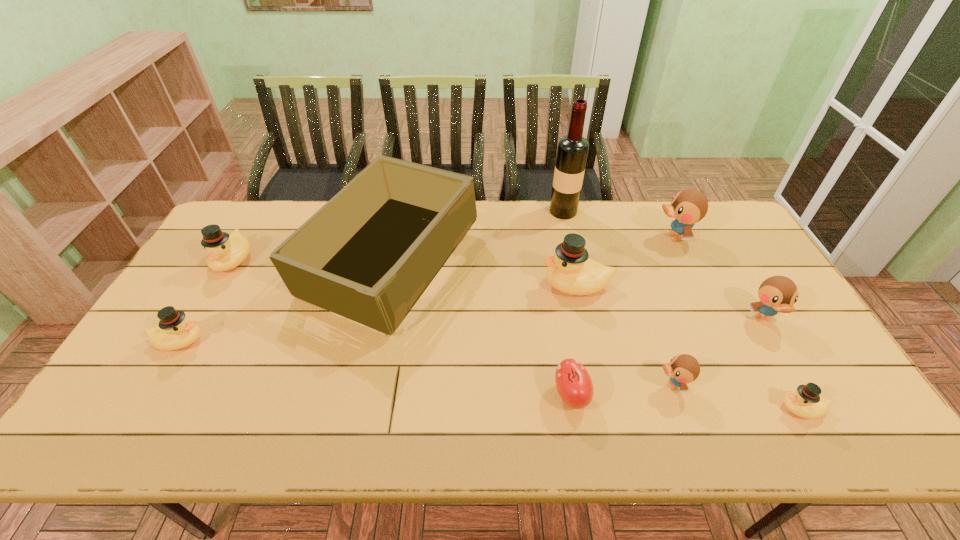
Locate an element on the screen. The height and width of the screenshot is (540, 960). vacant region located on the front-facing side of the leftmost blue duck is located at coordinates (504, 385).

I want to click on blank area located on the front-facing side of the shortest duck, so click(x=682, y=408).

Locate an element on the screen. Image resolution: width=960 pixels, height=540 pixels. vacant space located 0.240m on the front-facing side of the shortest duck is located at coordinates (678, 408).

The width and height of the screenshot is (960, 540). What are the coordinates of `vacant space situated on the front-facing side of the shortest duck` in the screenshot? It's located at 626,408.

Locate an element on the screen. Image resolution: width=960 pixels, height=540 pixels. wine bottle that is at the far edge is located at coordinates (572, 151).

Where is `box present at the far edge`? The width and height of the screenshot is (960, 540). box present at the far edge is located at coordinates (369, 254).

Locate an element on the screen. The width and height of the screenshot is (960, 540). apple positioned at the near edge is located at coordinates (573, 382).

I want to click on duck that is at the near edge, so click(805, 402).

You are a GUI agent. You are given a task and a screenshot of the screen. Output one action in this format:
    pyautogui.click(x=<x>, y=<y>)
    Task: Click on the object situated at the far left corner
    This screenshot has height=540, width=960.
    Given the screenshot: What is the action you would take?
    pyautogui.click(x=225, y=252)

This screenshot has height=540, width=960. Identify the location of object at the near right corner. (805, 402).